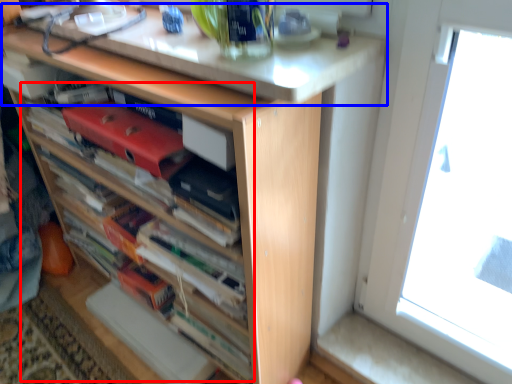
Question: Among these objects, which one is farthest to the camera, book (highlighted by a red box) or counter top (highlighted by a blue box)?

Choices:
 (A) book
 (B) counter top

Answer: (B)